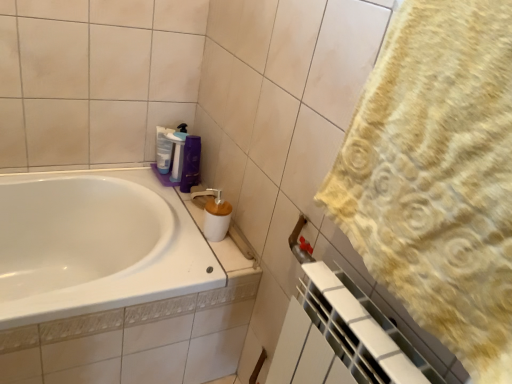
What do you see at coordinates (191, 163) in the screenshot? I see `purple glossy shampoo at upper center` at bounding box center [191, 163].

Describe the element at coordinates (163, 149) in the screenshot. I see `translucent plastic bottle at upper center, acting as the first cleaning product starting from the left` at that location.

This screenshot has height=384, width=512. I want to click on brown matte soap dispenser at center, so click(x=214, y=214).

Considering the relative sizes of translucent plastic bottle at upper center, the second cleaning product in the right-to-left sequence, and yellow textured towel at right in the image provided, is translucent plastic bottle at upper center, the second cleaning product in the right-to-left sequence, bigger than yellow textured towel at right?

No.

From the image's perspective, does translucent plastic bottle at upper center, the second cleaning product in the right-to-left sequence, appear higher than yellow textured towel at right?

Yes, from the image's perspective, translucent plastic bottle at upper center, the second cleaning product in the right-to-left sequence, is on top of yellow textured towel at right.

Does translucent plastic bottle at upper center, the second cleaning product in the right-to-left sequence, contain yellow textured towel at right?

No, yellow textured towel at right is not surrounded by translucent plastic bottle at upper center, the second cleaning product in the right-to-left sequence.

From a real-world perspective, relative to yellow textured towel at right, is translucent plastic bottle at upper center, acting as the first cleaning product starting from the left, vertically above or below?

From a real-world perspective, translucent plastic bottle at upper center, acting as the first cleaning product starting from the left, is physically below yellow textured towel at right.

Between translucent plastic bottle at upper center, acting as the first cleaning product starting from the left, and brown matte soap dispenser at center, which one is positioned in front?

brown matte soap dispenser at center is in front.

Considering the sizes of translucent plastic bottle at upper center, acting as the first cleaning product starting from the left, and brown matte soap dispenser at center in the image, is translucent plastic bottle at upper center, acting as the first cleaning product starting from the left, taller or shorter than brown matte soap dispenser at center?

In the image, translucent plastic bottle at upper center, acting as the first cleaning product starting from the left, appears to be taller than brown matte soap dispenser at center.

Which of these two, translucent plastic bottle at upper center, acting as the first cleaning product starting from the left, or brown matte soap dispenser at center, is smaller?

translucent plastic bottle at upper center, acting as the first cleaning product starting from the left.

Considering the sizes of yellow textured towel at right and purple plastic bottle at upper center, which is counted as the 1th cleaning product, starting from the right, in the image, is yellow textured towel at right bigger or smaller than purple plastic bottle at upper center, which is counted as the 1th cleaning product, starting from the right,?

Considering their sizes, yellow textured towel at right takes up more space than purple plastic bottle at upper center, which is counted as the 1th cleaning product, starting from the right.

Does yellow textured towel at right come in front of purple plastic bottle at upper center, which is counted as the 1th cleaning product, starting from the right?

Yes, yellow textured towel at right is closer to the viewer.

Between point (483, 326) and point (180, 132), which one is positioned behind?

The point (180, 132) is farther from the camera.

Where is `cleaning product behind the purple plastic bottle at upper center, which ranks as the second cleaning product in left-to-right order`? This screenshot has height=384, width=512. cleaning product behind the purple plastic bottle at upper center, which ranks as the second cleaning product in left-to-right order is located at coordinates (163, 149).

Does translucent plastic bottle at upper center, acting as the first cleaning product starting from the left, contain purple plastic bottle at upper center, which ranks as the second cleaning product in left-to-right order?

No, purple plastic bottle at upper center, which ranks as the second cleaning product in left-to-right order, is not surrounded by translucent plastic bottle at upper center, acting as the first cleaning product starting from the left.

Consider the image. From a real-world perspective, is translucent plastic bottle at upper center, the second cleaning product in the right-to-left sequence, beneath purple plastic bottle at upper center, which is counted as the 1th cleaning product, starting from the right?

Yes, from a real-world perspective, translucent plastic bottle at upper center, the second cleaning product in the right-to-left sequence, is under purple plastic bottle at upper center, which is counted as the 1th cleaning product, starting from the right.

What's the angular difference between translucent plastic bottle at upper center, the second cleaning product in the right-to-left sequence, and purple plastic bottle at upper center, which is counted as the 1th cleaning product, starting from the right,'s facing directions?

35.1 degrees.

From the image's perspective, is purple glossy shampoo at upper center below yellow textured towel at right?

Incorrect, from the image's perspective, purple glossy shampoo at upper center is higher than yellow textured towel at right.

Which is more to the right, purple glossy shampoo at upper center or yellow textured towel at right?

yellow textured towel at right.

From their relative heights in the image, would you say purple glossy shampoo at upper center is taller or shorter than yellow textured towel at right?

Clearly, purple glossy shampoo at upper center is shorter compared to yellow textured towel at right.

Does point (185, 183) lie behind point (466, 315)?

Yes, it is.

In the scene shown: Is purple glossy shampoo at upper center looking in the opposite direction of brown matte soap dispenser at center?

No, purple glossy shampoo at upper center is not facing the opposite direction of brown matte soap dispenser at center.

Which object is wider, purple glossy shampoo at upper center or brown matte soap dispenser at center?

With larger width is brown matte soap dispenser at center.

Which is closer, (x=196, y=158) or (x=207, y=193)?

Point (x=196, y=158) is farther from the camera than point (x=207, y=193).

Relative to brown matte soap dispenser at center, is purple glossy shampoo at upper center in front or behind?

purple glossy shampoo at upper center is positioned farther from the viewer than brown matte soap dispenser at center.

From a real-world perspective, which is physically below, purple plastic bottle at upper center, which is counted as the 1th cleaning product, starting from the right, or brown matte soap dispenser at center?

In real-world perspective, brown matte soap dispenser at center is lower.

Would you say purple plastic bottle at upper center, which is counted as the 1th cleaning product, starting from the right, is outside brown matte soap dispenser at center?

purple plastic bottle at upper center, which is counted as the 1th cleaning product, starting from the right, is positioned outside brown matte soap dispenser at center.

From the image's perspective, between purple plastic bottle at upper center, which is counted as the 1th cleaning product, starting from the right, and brown matte soap dispenser at center, which one is located above?

purple plastic bottle at upper center, which is counted as the 1th cleaning product, starting from the right.

Is purple plastic bottle at upper center, which is counted as the 1th cleaning product, starting from the right, oriented towards brown matte soap dispenser at center?

Yes, purple plastic bottle at upper center, which is counted as the 1th cleaning product, starting from the right, is oriented towards brown matte soap dispenser at center.

The height and width of the screenshot is (384, 512). Identify the location of bath towel that is on the right side of translucent plastic bottle at upper center, acting as the first cleaning product starting from the left. (437, 176).

Find the location of a particular element. cleaning product that is the 2nd object to the left of the brown matte soap dispenser at center, starting at the anchor is located at coordinates (163, 149).

From the image, which object appears to be nearer to yellow textured towel at right, brown matte soap dispenser at center or purple plastic bottle at upper center, which ranks as the second cleaning product in left-to-right order?

brown matte soap dispenser at center is closer to yellow textured towel at right.

From the image, which object appears to be nearer to purple glossy shampoo at upper center, translucent plastic bottle at upper center, the second cleaning product in the right-to-left sequence, or yellow textured towel at right?

Based on the image, translucent plastic bottle at upper center, the second cleaning product in the right-to-left sequence, appears to be nearer to purple glossy shampoo at upper center.

Estimate the real-world distances between objects in this image. Which object is further from purple plastic bottle at upper center, which is counted as the 1th cleaning product, starting from the right, brown matte soap dispenser at center or purple glossy shampoo at upper center?

Based on the image, brown matte soap dispenser at center appears to be further to purple plastic bottle at upper center, which is counted as the 1th cleaning product, starting from the right.

Estimate the real-world distances between objects in this image. Which object is further from purple glossy shampoo at upper center, purple plastic bottle at upper center, which ranks as the second cleaning product in left-to-right order, or brown matte soap dispenser at center?

brown matte soap dispenser at center lies further to purple glossy shampoo at upper center than the other object.

Looking at the image, which one is located further to purple glossy shampoo at upper center, brown matte soap dispenser at center or purple plastic bottle at upper center, which is counted as the 1th cleaning product, starting from the right?

Among the two, brown matte soap dispenser at center is located further to purple glossy shampoo at upper center.

Estimate the real-world distances between objects in this image. Which object is closer to purple plastic bottle at upper center, which ranks as the second cleaning product in left-to-right order, yellow textured towel at right or brown matte soap dispenser at center?

Among the two, brown matte soap dispenser at center is located nearer to purple plastic bottle at upper center, which ranks as the second cleaning product in left-to-right order.

From the picture: From the image, which object appears to be nearer to yellow textured towel at right, purple glossy shampoo at upper center or purple plastic bottle at upper center, which ranks as the second cleaning product in left-to-right order?

purple glossy shampoo at upper center is closer to yellow textured towel at right.

When comparing their distances from translucent plastic bottle at upper center, acting as the first cleaning product starting from the left, does brown matte soap dispenser at center or yellow textured towel at right seem further?

The object further to translucent plastic bottle at upper center, acting as the first cleaning product starting from the left, is yellow textured towel at right.

Locate an element on the screen. Image resolution: width=512 pixels, height=384 pixels. cleaning product between translucent plastic bottle at upper center, the second cleaning product in the right-to-left sequence, and purple glossy shampoo at upper center is located at coordinates (177, 151).

Image resolution: width=512 pixels, height=384 pixels. I want to click on soap dispenser located between yellow textured towel at right and translucent plastic bottle at upper center, acting as the first cleaning product starting from the left, in the depth direction, so click(x=214, y=214).

At what (x,y) coordinates should I click in order to perform the action: click on cleaning product located between yellow textured towel at right and translucent plastic bottle at upper center, acting as the first cleaning product starting from the left, in the depth direction. Please return your answer as a coordinate pair (x, y). Looking at the image, I should click on (177, 151).

At what (x,y) coordinates should I click in order to perform the action: click on cleaning product between brown matte soap dispenser at center and translucent plastic bottle at upper center, acting as the first cleaning product starting from the left, in the front-back direction. Please return your answer as a coordinate pair (x, y). Image resolution: width=512 pixels, height=384 pixels. Looking at the image, I should click on (177, 151).